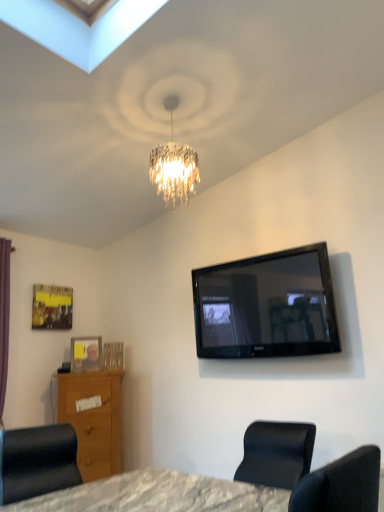
At what (x,y) coordinates should I click in order to perform the action: click on matte black chair at lower left. Please return your answer as a coordinate pair (x, y). Looking at the image, I should click on (37, 461).

The height and width of the screenshot is (512, 384). What do you see at coordinates (86, 353) in the screenshot?
I see `clear plastic picture frame at lower left, the first picture frame when ordered from bottom to top` at bounding box center [86, 353].

Find the location of a particular element. matte black chair at lower left is located at coordinates (37, 461).

Identify the location of vanity located behind the matte black chair at lower left. This screenshot has height=512, width=384. (93, 420).

Based on the photo, which object is positioned more to the left, wooden vanity at lower left or matte black chair at lower left?

From the viewer's perspective, wooden vanity at lower left appears more on the left side.

From the image's perspective, is wooden vanity at lower left below matte black chair at lower left?

Indeed, from the image's perspective, wooden vanity at lower left is shown beneath matte black chair at lower left.

Does wooden vanity at lower left turn towards matte black chair at lower left?

Yes, wooden vanity at lower left is aimed at matte black chair at lower left.

From the image's perspective, between clear plastic picture frame at lower left, the first picture frame when ordered from bottom to top, and matte black chair at lower left, who is located below?

matte black chair at lower left appears lower in the image.

Does clear plastic picture frame at lower left, the first picture frame when ordered from bottom to top, lie in front of matte black chair at lower left?

No.

How much distance is there between clear plastic picture frame at lower left, which is the second picture frame from left to right, and matte black chair at lower left?

clear plastic picture frame at lower left, which is the second picture frame from left to right, and matte black chair at lower left are 3.98 feet apart.

From the image's perspective, which one is positioned higher, black glossy tv at upper right or clear plastic picture frame at lower left, acting as the first picture frame starting from the right?

black glossy tv at upper right.

Find the location of `television that is above the clear plastic picture frame at lower left, placed as the second picture frame when sorted from top to bottom (from the image's perspective)`. television that is above the clear plastic picture frame at lower left, placed as the second picture frame when sorted from top to bottom (from the image's perspective) is located at coordinates (266, 306).

Would you say black glossy tv at upper right is outside clear plastic picture frame at lower left, which is the second picture frame from left to right?

black glossy tv at upper right is positioned outside clear plastic picture frame at lower left, which is the second picture frame from left to right.

Is black glossy tv at upper right to the right of clear plastic picture frame at lower left, acting as the first picture frame starting from the right, from the viewer's perspective?

Indeed, black glossy tv at upper right is positioned on the right side of clear plastic picture frame at lower left, acting as the first picture frame starting from the right.

Is wooden vanity at lower left next to clear plastic picture frame at lower left, placed as the second picture frame when sorted from top to bottom, and touching it?

No, wooden vanity at lower left is not beside clear plastic picture frame at lower left, placed as the second picture frame when sorted from top to bottom.

Considering the positions of points (85, 458) and (98, 357), is point (85, 458) closer to camera compared to point (98, 357)?

Yes.

From the image's perspective, is wooden vanity at lower left located above clear plastic picture frame at lower left, acting as the first picture frame starting from the right?

No, from the image's perspective, wooden vanity at lower left is not above clear plastic picture frame at lower left, acting as the first picture frame starting from the right.

Is wooden vanity at lower left taller than clear plastic picture frame at lower left, the first picture frame when ordered from bottom to top?

Yes, wooden vanity at lower left is taller than clear plastic picture frame at lower left, the first picture frame when ordered from bottom to top.

Is matte black chair at lower left located outside black glossy tv at upper right?

Absolutely, matte black chair at lower left is external to black glossy tv at upper right.

Considering the positions of objects matte black chair at lower left and black glossy tv at upper right in the image provided, who is more to the right, matte black chair at lower left or black glossy tv at upper right?

black glossy tv at upper right.

From a real-world perspective, who is located lower, matte black chair at lower left or black glossy tv at upper right?

In real-world perspective, matte black chair at lower left is lower.

Identify the location of chair that is under the black glossy tv at upper right (from a real-world perspective). The height and width of the screenshot is (512, 384). (37, 461).

Considering the sizes of clear plastic picture frame at lower left, acting as the first picture frame starting from the right, and wooden vanity at lower left in the image, is clear plastic picture frame at lower left, acting as the first picture frame starting from the right, taller or shorter than wooden vanity at lower left?

Considering their sizes, clear plastic picture frame at lower left, acting as the first picture frame starting from the right, has less height than wooden vanity at lower left.

Is clear plastic picture frame at lower left, placed as the second picture frame when sorted from top to bottom, positioned beyond the bounds of wooden vanity at lower left?

Yes, clear plastic picture frame at lower left, placed as the second picture frame when sorted from top to bottom, is located beyond the bounds of wooden vanity at lower left.

How many degrees apart are the facing directions of clear plastic picture frame at lower left, which is the second picture frame from left to right, and wooden vanity at lower left?

The facing directions of clear plastic picture frame at lower left, which is the second picture frame from left to right, and wooden vanity at lower left are 7.51 degrees apart.

Which object is closer to the camera, clear plastic picture frame at lower left, the first picture frame when ordered from bottom to top, or wooden vanity at lower left?

wooden vanity at lower left is more forward.

From the picture: Measure the distance between matte black chair at lower left and wooden vanity at lower left.

matte black chair at lower left and wooden vanity at lower left are 39.02 inches apart from each other.

Is wooden vanity at lower left a part of matte black chair at lower left?

No, wooden vanity at lower left is not surrounded by matte black chair at lower left.

Is matte black chair at lower left looking in the opposite direction of wooden vanity at lower left?

No.

From a real-world perspective, between matte black chair at lower left and wooden vanity at lower left, who is vertically lower?

In real-world perspective, matte black chair at lower left is lower.

Where is `vanity above the matte black chair at lower left (from a real-world perspective)`? Image resolution: width=384 pixels, height=512 pixels. vanity above the matte black chair at lower left (from a real-world perspective) is located at coordinates (93, 420).

At what (x,y) coordinates should I click in order to perform the action: click on the 1st picture frame behind the matte black chair at lower left. Please return your answer as a coordinate pair (x, y). This screenshot has height=512, width=384. Looking at the image, I should click on (86, 353).

Which object lies nearer to the anchor point clear plastic picture frame at lower left, acting as the first picture frame starting from the right, black glossy tv at upper right or metallic gold picture frame at upper left, which appears as the first picture frame when viewed from the top?

metallic gold picture frame at upper left, which appears as the first picture frame when viewed from the top, is positioned closer to the anchor clear plastic picture frame at lower left, acting as the first picture frame starting from the right.

Which object lies nearer to the anchor point clear plastic picture frame at lower left, placed as the second picture frame when sorted from top to bottom, black glossy tv at upper right or wooden vanity at lower left?

wooden vanity at lower left is closer to clear plastic picture frame at lower left, placed as the second picture frame when sorted from top to bottom.

Estimate the real-world distances between objects in this image. Which object is further from metallic gold picture frame at upper left, acting as the 2th picture frame starting from the right, wooden vanity at lower left or black glossy tv at upper right?

Based on the image, black glossy tv at upper right appears to be further to metallic gold picture frame at upper left, acting as the 2th picture frame starting from the right.

Which object lies nearer to the anchor point clear plastic picture frame at lower left, the first picture frame when ordered from bottom to top, black glossy tv at upper right or matte black chair at lower left?

Based on the image, matte black chair at lower left appears to be nearer to clear plastic picture frame at lower left, the first picture frame when ordered from bottom to top.

Looking at the image, which one is located further to black glossy tv at upper right, matte black chair at lower left or clear plastic picture frame at lower left, which is the second picture frame from left to right?

Among the two, matte black chair at lower left is located further to black glossy tv at upper right.

From the image, which object appears to be nearer to clear plastic picture frame at lower left, placed as the second picture frame when sorted from top to bottom, metallic gold picture frame at upper left, placed as the 2th picture frame when sorted from bottom to top, or wooden vanity at lower left?

metallic gold picture frame at upper left, placed as the 2th picture frame when sorted from bottom to top, is closer to clear plastic picture frame at lower left, placed as the second picture frame when sorted from top to bottom.

From the image, which object appears to be farther from wooden vanity at lower left, clear plastic picture frame at lower left, which is the second picture frame from left to right, or matte black chair at lower left?

matte black chair at lower left lies further to wooden vanity at lower left than the other object.

Which object lies nearer to the anchor point wooden vanity at lower left, matte black chair at lower left or clear plastic picture frame at lower left, the first picture frame when ordered from bottom to top?

clear plastic picture frame at lower left, the first picture frame when ordered from bottom to top.

Identify the location of vanity located between matte black chair at lower left and clear plastic picture frame at lower left, which is the second picture frame from left to right, in the depth direction. This screenshot has height=512, width=384. (93, 420).

Identify the location of vanity between matte black chair at lower left and metallic gold picture frame at upper left, the first picture frame from the left, in the front-back direction. (93, 420).

This screenshot has height=512, width=384. I want to click on vanity located between metallic gold picture frame at upper left, which appears as the first picture frame when viewed from the top, and black glossy tv at upper right in the left-right direction, so click(93, 420).

Identify the location of vanity between clear plastic picture frame at lower left, which is the second picture frame from left to right, and black glossy tv at upper right from left to right. This screenshot has width=384, height=512. (93, 420).